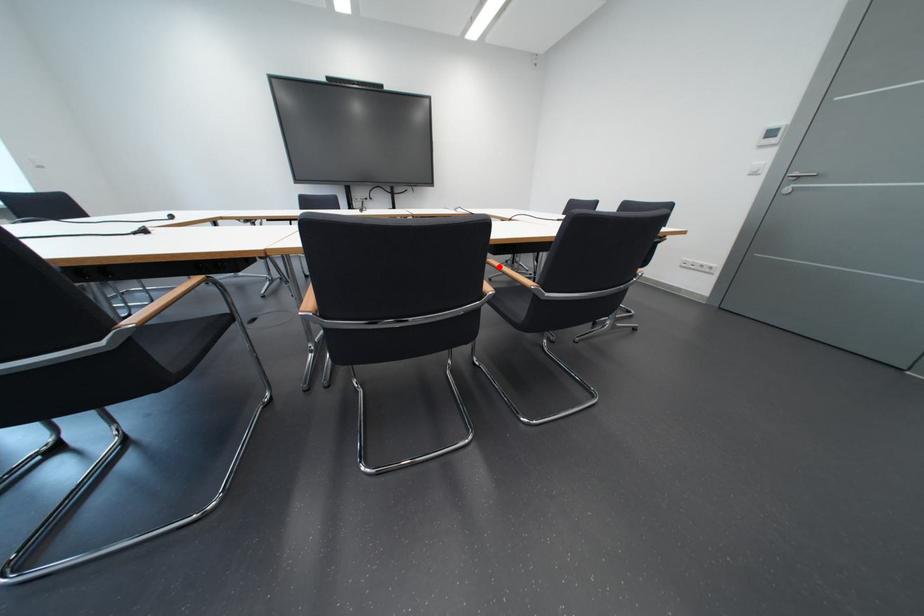
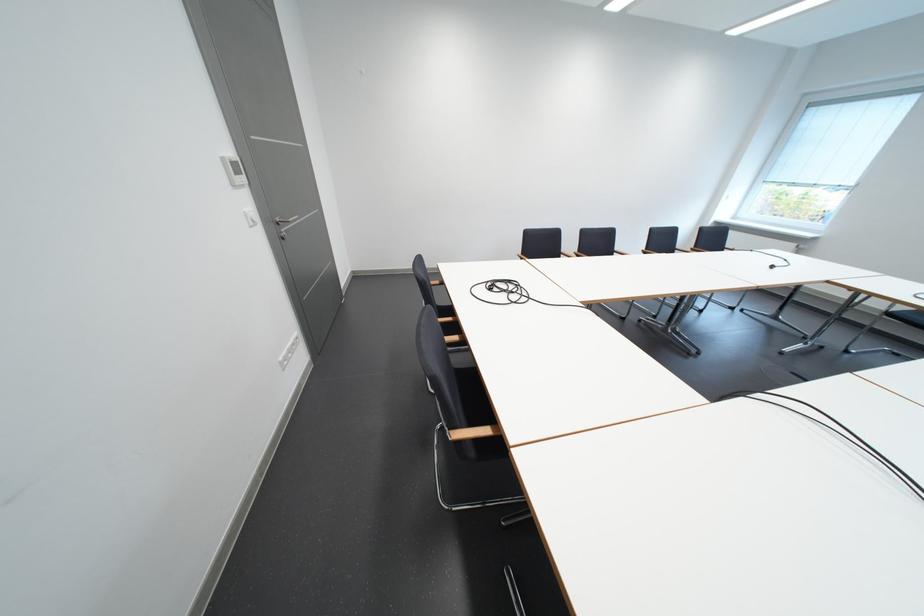
Question: I am providing you with two images of the same scene from different viewpoints. A red point is marked on the first image. Is the red point's position out of view in image 2?

Choices:
 (A) Yes
 (B) No

Answer: (A)